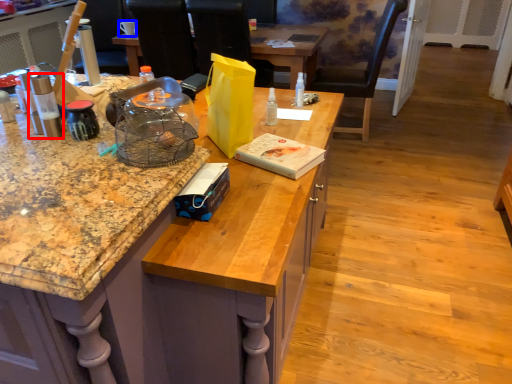
Question: Which object is further to the camera taking this photo, kitchen appliance (highlighted by a red box) or coffee cup (highlighted by a blue box)?

Choices:
 (A) kitchen appliance
 (B) coffee cup

Answer: (B)